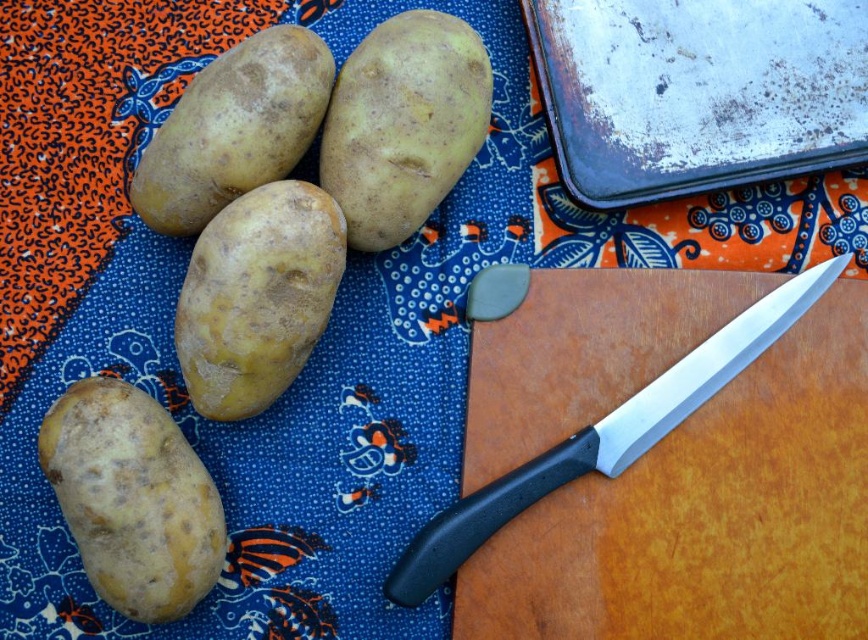
Question: Is rusty metal tray at upper right further to camera compared to smooth yellow potato at lower left?

Choices:
 (A) yes
 (B) no

Answer: (A)

Question: Which object appears farthest from the camera in this image?

Choices:
 (A) yellow matte potato at center
 (B) smooth yellow potato at center

Answer: (B)

Question: Does smooth yellow potato at center have a lesser width compared to black plastic knife at center?

Choices:
 (A) yes
 (B) no

Answer: (A)

Question: Which object appears farthest from the camera in this image?

Choices:
 (A) smooth yellow potato at center
 (B) rusty metal tray at upper right
 (C) yellow matte potato at center
 (D) black plastic knife at center

Answer: (B)

Question: Which of the following is the closest to the observer?

Choices:
 (A) (251, 166)
 (B) (661, 58)

Answer: (A)

Question: Can you confirm if smooth yellow potato at center is positioned below matte yellow potato at upper left?

Choices:
 (A) yes
 (B) no

Answer: (B)